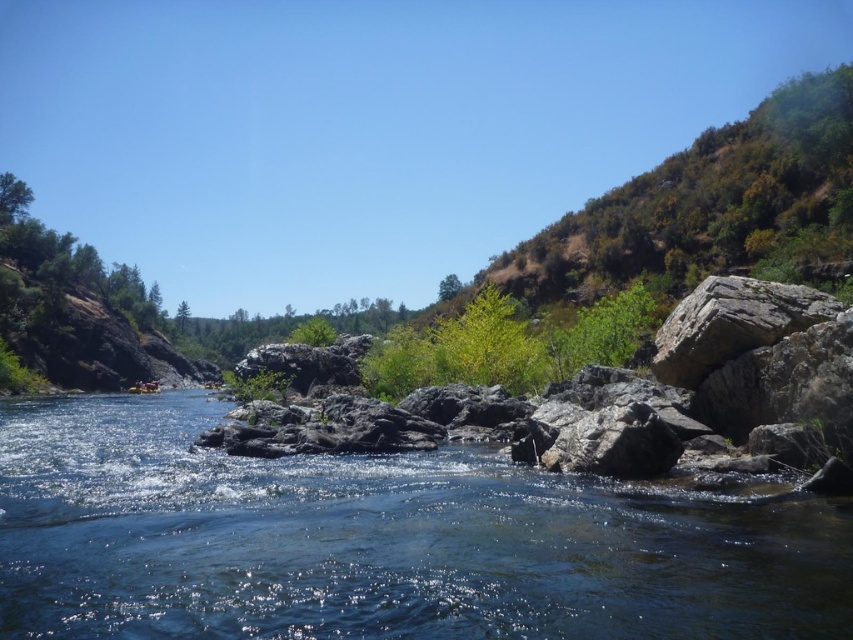
Is clear water at center to the right of green leafy tree at upper center from the viewer's perspective?

No, clear water at center is not to the right of green leafy tree at upper center.

Describe the element at coordinates (381, 541) in the screenshot. The height and width of the screenshot is (640, 853). I see `clear water at center` at that location.

The width and height of the screenshot is (853, 640). I want to click on clear water at center, so click(x=381, y=541).

The width and height of the screenshot is (853, 640). Find the location of `clear water at center`. clear water at center is located at coordinates [381, 541].

Is the position of gray rock at center more distant than that of green leafy tree at upper center?

No, gray rock at center is closer to the viewer.

Does gray rock at center appear on the left side of green leafy tree at upper center?

Indeed, gray rock at center is positioned on the left side of green leafy tree at upper center.

Between point (375, 444) and point (454, 291), which one is positioned behind?

The point (454, 291) is behind.

Image resolution: width=853 pixels, height=640 pixels. What are the coordinates of `gray rock at center` in the screenshot? It's located at (601, 394).

Find the location of a particular element. clear water at center is located at coordinates (381, 541).

Does point (209, 500) come closer to viewer compared to point (372, 444)?

Yes, point (209, 500) is in front of point (372, 444).

Locate an element on the screen. Image resolution: width=853 pixels, height=640 pixels. clear water at center is located at coordinates (381, 541).

This screenshot has height=640, width=853. I want to click on clear water at center, so (381, 541).